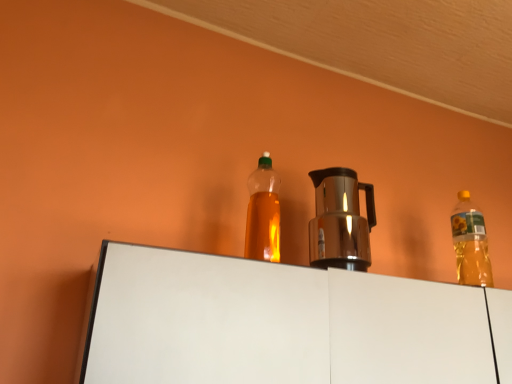
Question: From the image's perspective, is translucent plastic bottle at upper right, the first bottle when ordered from right to left, above or below shiny metallic coffee pot at center?

Choices:
 (A) below
 (B) above

Answer: (A)

Question: Considering the positions of translucent plastic bottle at upper right, the 2th bottle viewed from the front, and shiny metallic coffee pot at center in the image, is translucent plastic bottle at upper right, the 2th bottle viewed from the front, bigger or smaller than shiny metallic coffee pot at center?

Choices:
 (A) big
 (B) small

Answer: (B)

Question: Estimate the real-world distances between objects in this image. Which object is closer to the translucent plastic bottle at upper right, the first bottle when ordered from right to left?

Choices:
 (A) translucent plastic bottle at center, the 1th bottle when ordered from front to back
 (B) shiny metallic coffee pot at center

Answer: (B)

Question: Considering the real-world distances, which object is closest to the translucent plastic bottle at upper right, the 1th bottle from the back?

Choices:
 (A) translucent plastic bottle at center, the 1th bottle when ordered from front to back
 (B) shiny metallic coffee pot at center

Answer: (B)